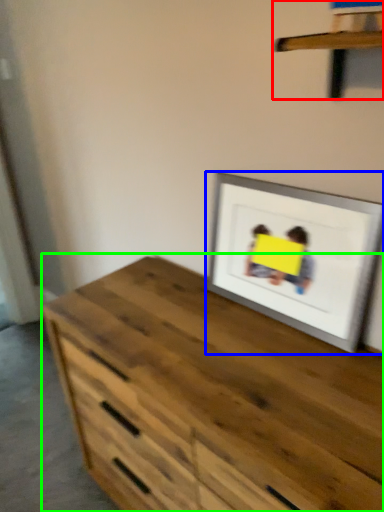
Question: Which object is positioned closest to shelf (highlighted by a red box)? Select from picture frame (highlighted by a blue box) and chest of drawers (highlighted by a green box).

Choices:
 (A) picture frame
 (B) chest of drawers

Answer: (A)